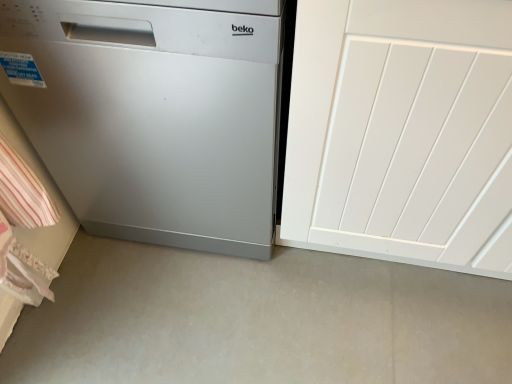
Question: In the image, is satin silver dishwasher at left positioned in front of or behind white painted wood door at right?

Choices:
 (A) behind
 (B) front

Answer: (A)

Question: Considering the positions of point (264, 147) and point (483, 180), is point (264, 147) closer or farther from the camera than point (483, 180)?

Choices:
 (A) closer
 (B) farther

Answer: (B)

Question: Considering the positions of satin silver dishwasher at left and white painted wood door at right in the image, is satin silver dishwasher at left wider or thinner than white painted wood door at right?

Choices:
 (A) thin
 (B) wide

Answer: (A)

Question: Is white painted wood door at right situated inside satin silver dishwasher at left or outside?

Choices:
 (A) outside
 (B) inside

Answer: (A)

Question: In terms of width, does white painted wood door at right look wider or thinner when compared to satin silver dishwasher at left?

Choices:
 (A) thin
 (B) wide

Answer: (B)

Question: Considering their positions, is white painted wood door at right located in front of or behind satin silver dishwasher at left?

Choices:
 (A) front
 (B) behind

Answer: (A)

Question: Does point (416, 193) appear closer or farther from the camera than point (236, 251)?

Choices:
 (A) farther
 (B) closer

Answer: (B)